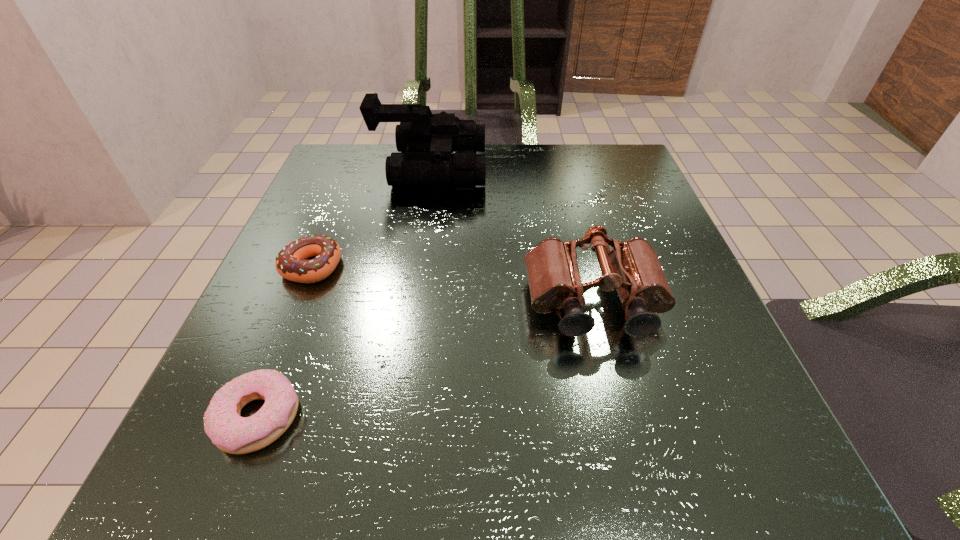
The width and height of the screenshot is (960, 540). In order to click on free space at the right edge of the desktop in this screenshot , I will do `click(652, 236)`.

The height and width of the screenshot is (540, 960). What are the coordinates of `free space at the far left corner of the desktop` in the screenshot? It's located at (318, 198).

Find the location of `free space at the near left corner of the desktop`. free space at the near left corner of the desktop is located at coordinates pos(205,471).

The height and width of the screenshot is (540, 960). In the image, there is a desktop. In order to click on vacant area at the far right corner in this screenshot , I will do `click(583, 159)`.

I want to click on free space that is in between the right binoculars and the tallest object, so click(512, 237).

At what (x,y) coordinates should I click in order to perform the action: click on blank region between the nearer binoculars and the tallest object. Please return your answer as a coordinate pair (x, y). Image resolution: width=960 pixels, height=540 pixels. Looking at the image, I should click on (512, 237).

This screenshot has height=540, width=960. In order to click on free space that is in between the left binoculars and the farther doughnut in this screenshot , I will do `click(371, 218)`.

Find the location of a particular element. The width and height of the screenshot is (960, 540). free spot between the farthest object and the nearest object is located at coordinates (344, 293).

Find the location of `free space between the third shortest object and the farther doughnut`. free space between the third shortest object and the farther doughnut is located at coordinates (453, 285).

I want to click on free space that is in between the farthest object and the rightmost object, so click(512, 237).